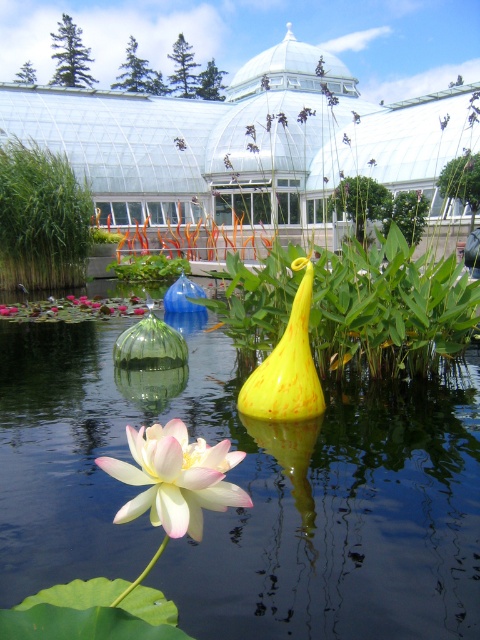
You are standing at the edge of the pond in the garden scene. There is a point marked at coordinates (249, 493). Based on the description, where is this point located?

The point at coordinates (249, 493) is located on the transparent glass water at center.

You are standing in the garden and want to walk from the white lotus flower to the glass sculptures. According to the coordinates provided, which point should you aim for first, point (15, 234) or point (163, 515)?

You should aim for point (163, 515) first because point (15, 234) is behind it, meaning point (163, 515) is closer to your current position near the white lotus flower.

You are designing a garden layout and need to place a small decorative stone between the green grass at left and the yellow matte vase at center. Based on their sizes, which object should the stone be closer to?

The green grass at left is bigger than the yellow matte vase at center, so the stone should be placed closer to the yellow matte vase at center to balance the sizes.